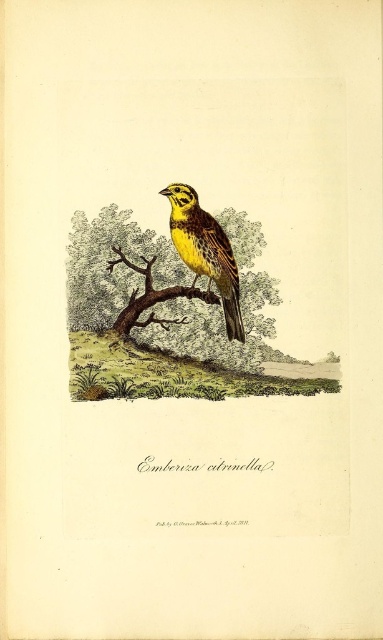
Question: Estimate the real-world distances between objects in this image. Which object is closer to the yellow matte bird at center?

Choices:
 (A) brown wood at center
 (B) brown textured branch at center

Answer: (B)

Question: Which point is closer to the camera taking this photo?

Choices:
 (A) (158, 300)
 (B) (209, 262)

Answer: (A)

Question: Does brown textured branch at center lie behind yellow matte bird at center?

Choices:
 (A) yes
 (B) no

Answer: (B)

Question: From the image, what is the correct spatial relationship of brown textured branch at center in relation to brown wood at center?

Choices:
 (A) above
 (B) below

Answer: (A)

Question: Is yellow matte bird at center further to the viewer compared to brown wood at center?

Choices:
 (A) no
 (B) yes

Answer: (A)

Question: Among these objects, which one is nearest to the camera?

Choices:
 (A) brown wood at center
 (B) yellow matte bird at center
 (C) brown textured branch at center

Answer: (C)